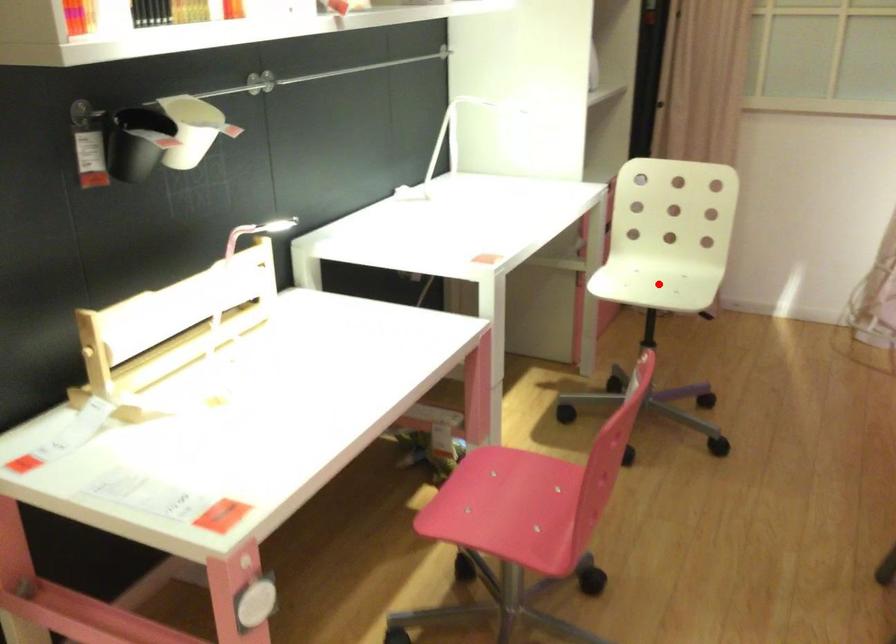
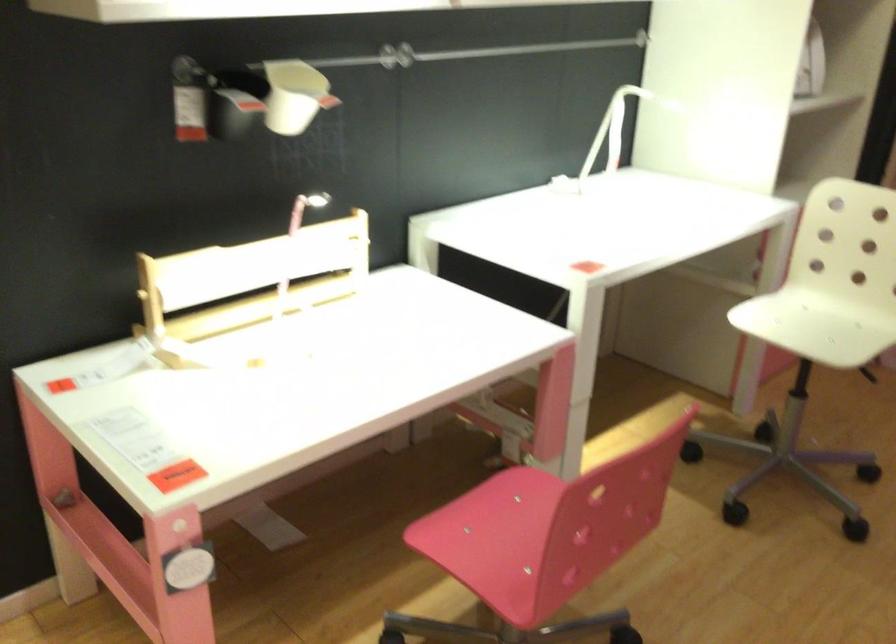
Question: I am providing you with two images of the same scene from different viewpoints. In image1, a red point is highlighted. Considering the same 3D point in image2, which of the following is correct?

Choices:
 (A) It is closer
 (B) It is farther

Answer: (A)